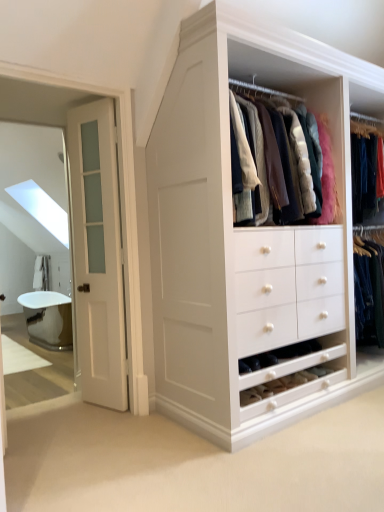
This screenshot has width=384, height=512. Find the location of `free location above white frosted glass door at left (from a real-world perspective)`. free location above white frosted glass door at left (from a real-world perspective) is located at coordinates (88, 100).